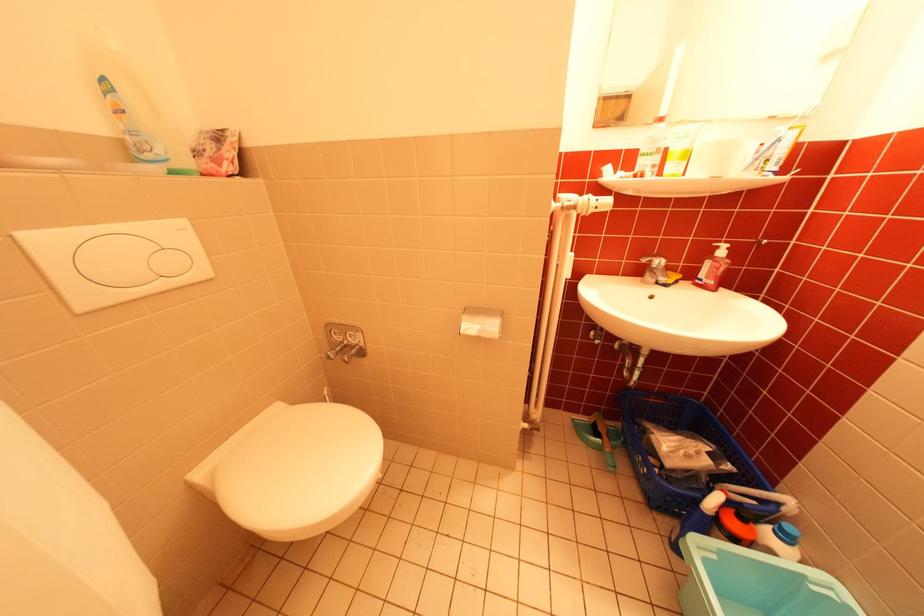
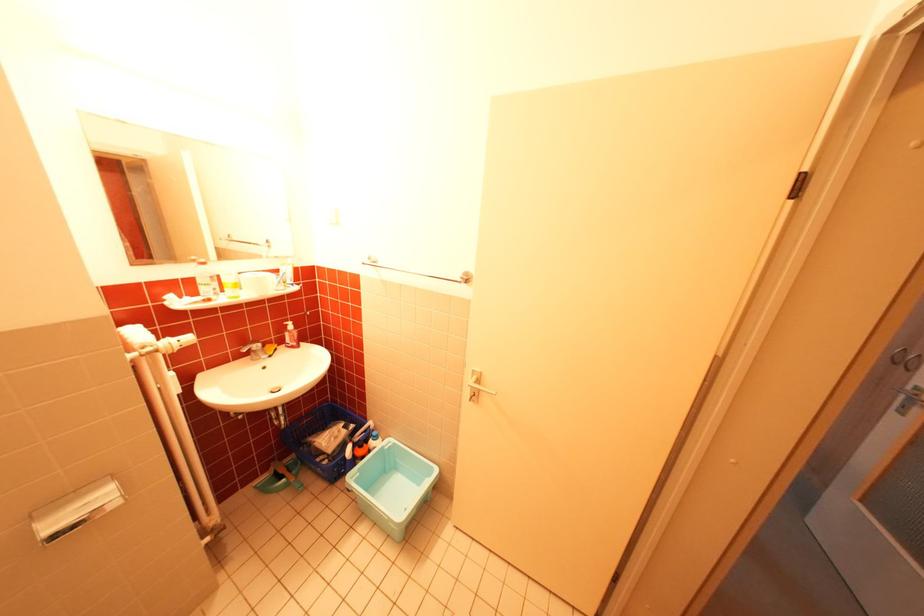
Question: Based on the continuous images, in which direction is the camera rotating? Reply with the corresponding letter.

Choices:
 (A) Left
 (B) Right
 (C) Up
 (D) Down

Answer: (B)